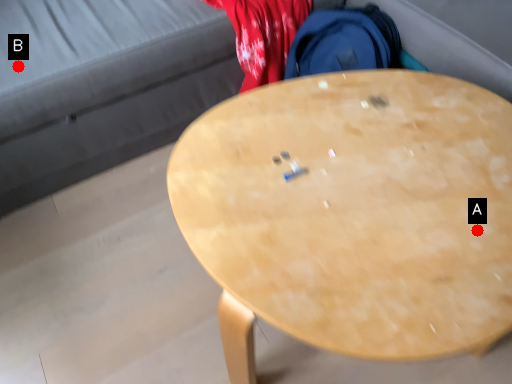
Question: Two points are circled on the image, labeled by A and B beside each circle. Which of the following is the closest to the observer?

Choices:
 (A) A is closer
 (B) B is closer

Answer: (A)